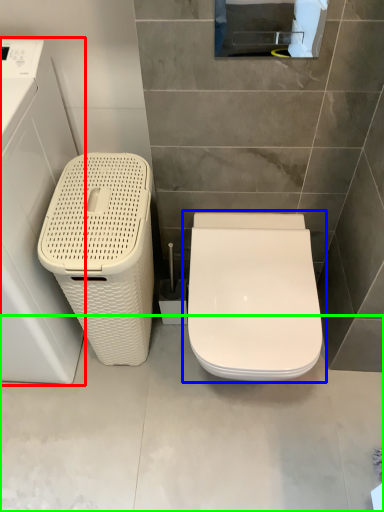
Question: Considering the real-world distances, which object is closest to washing machine (highlighted by a red box)? toilet (highlighted by a blue box) or concrete (highlighted by a green box).

Choices:
 (A) toilet
 (B) concrete

Answer: (B)